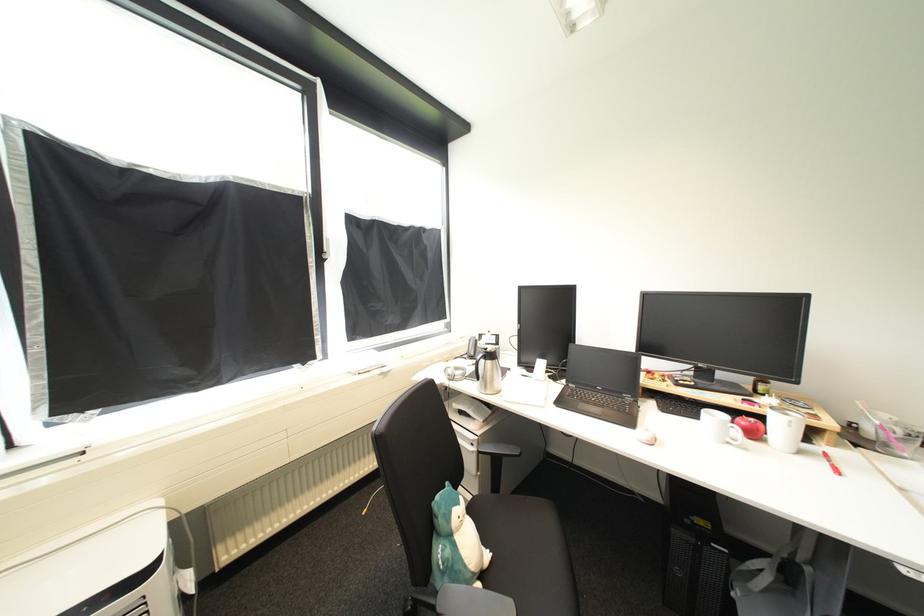
Image resolution: width=924 pixels, height=616 pixels. I want to click on grey backpack, so click(x=776, y=580).